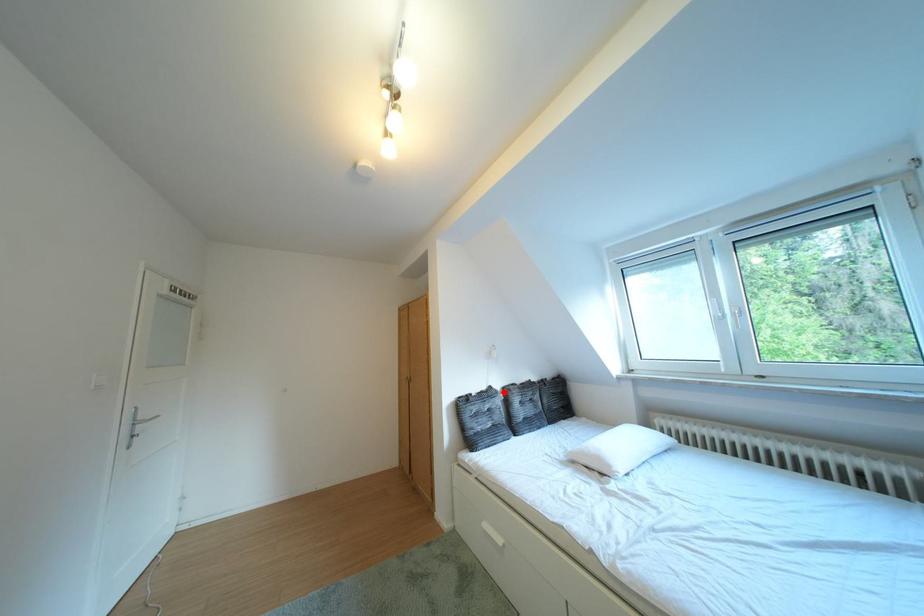
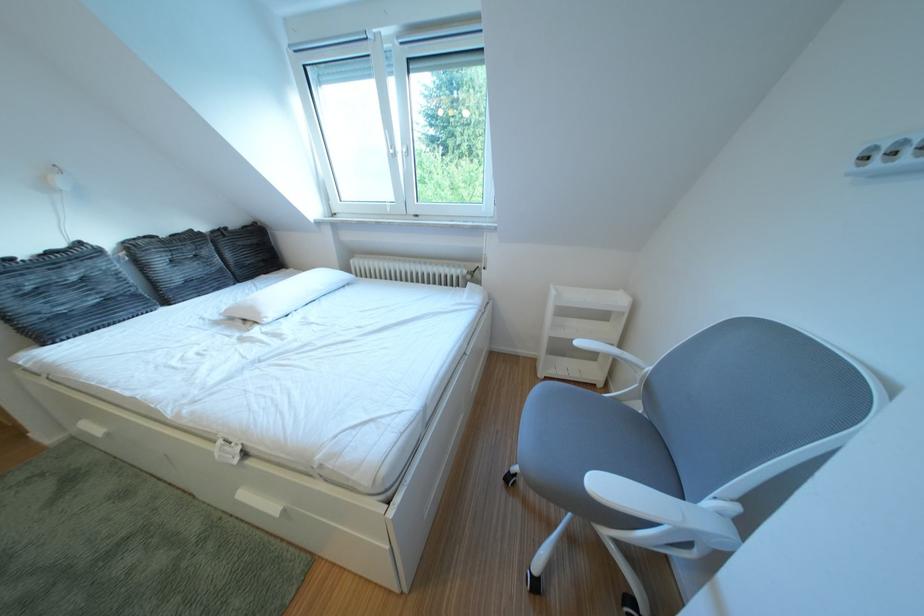
The point at the highlighted location is marked in the first image. Where is the corresponding point in the second image?

(93, 249)